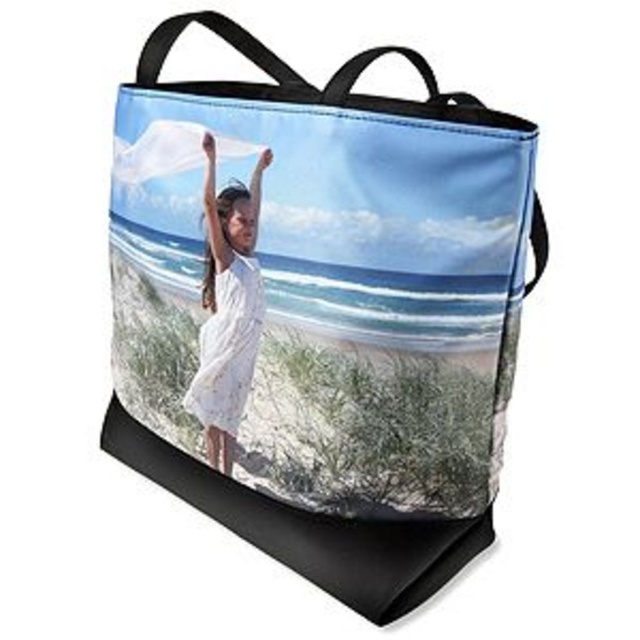
Question: Estimate the real-world distances between objects in this image. Which object is farther from the white cotton dress at center?

Choices:
 (A) white lace dress at center
 (B) matte fabric tote bag at center

Answer: (B)

Question: Which point is closer to the camera?

Choices:
 (A) pyautogui.click(x=333, y=584)
 (B) pyautogui.click(x=204, y=362)
 (C) pyautogui.click(x=227, y=333)

Answer: (A)

Question: Is matte fabric tote bag at center to the right of white lace dress at center from the viewer's perspective?

Choices:
 (A) yes
 (B) no

Answer: (A)

Question: Can you confirm if matte fabric tote bag at center is positioned to the right of white lace dress at center?

Choices:
 (A) no
 (B) yes

Answer: (B)

Question: Is matte fabric tote bag at center above white cotton dress at center?

Choices:
 (A) yes
 (B) no

Answer: (B)

Question: Which object is farther from the camera taking this photo?

Choices:
 (A) white cotton dress at center
 (B) matte fabric tote bag at center
 (C) white lace dress at center

Answer: (C)